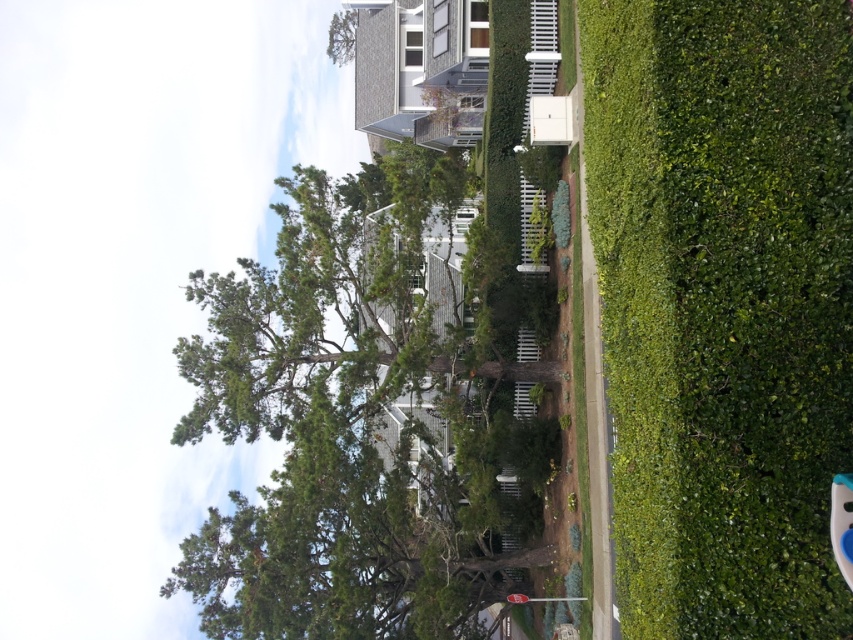
Question: Considering the real-world distances, which object is closest to the green leafy tree at center?

Choices:
 (A) metallic silver street sign at lower center
 (B) green leafy tree at upper center
 (C) green leafy hedge at right

Answer: (A)

Question: Is green leafy tree at center above green leafy tree at upper center?

Choices:
 (A) no
 (B) yes

Answer: (A)

Question: Among these objects, which one is nearest to the camera?

Choices:
 (A) green leafy tree at center
 (B) green leafy tree at upper center

Answer: (A)

Question: Which point is closer to the camera?

Choices:
 (A) pos(352,35)
 (B) pos(828,268)

Answer: (B)

Question: Can you confirm if green leafy tree at center is positioned above metallic silver street sign at lower center?

Choices:
 (A) no
 (B) yes

Answer: (B)

Question: Can you confirm if green leafy tree at center is wider than green leafy tree at upper center?

Choices:
 (A) no
 (B) yes

Answer: (B)